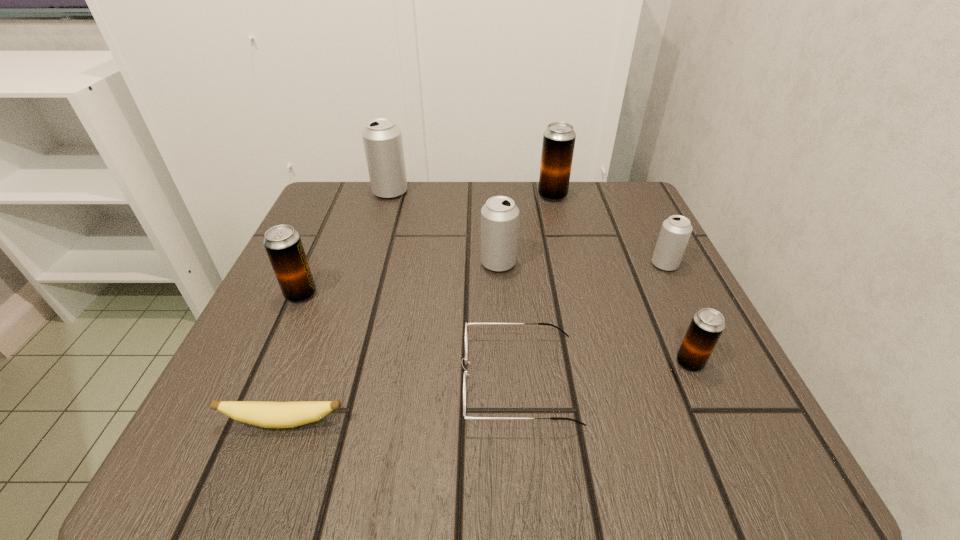
Find the location of a particular element. This screenshot has width=960, height=540. free location at the far edge is located at coordinates (507, 188).

The image size is (960, 540). Find the location of `vacant space at the near edge of the desktop`. vacant space at the near edge of the desktop is located at coordinates (559, 417).

The image size is (960, 540). What are the coordinates of `vacant space at the left edge of the desktop` in the screenshot? It's located at (276, 334).

I want to click on vacant space at the right edge of the desktop, so click(676, 337).

Locate an element on the screen. This screenshot has width=960, height=540. blank space at the far left corner is located at coordinates (375, 203).

In the image, there is a desktop. Find the location of `vacant region at the far right corner`. vacant region at the far right corner is located at coordinates (629, 215).

Locate an element on the screen. Image resolution: width=960 pixels, height=540 pixels. unoccupied area between the farthest white beer can and the rightmost white beer can is located at coordinates (527, 228).

This screenshot has height=540, width=960. Identify the location of free space between the fourth beer can from right to left and the fifth beer can from right to left. (444, 227).

Find the location of `vacant space in between the smallest black beer can and the yellow banana`. vacant space in between the smallest black beer can and the yellow banana is located at coordinates (487, 392).

Where is `free area in between the shortest object and the smallest white beer can`? Image resolution: width=960 pixels, height=540 pixels. free area in between the shortest object and the smallest white beer can is located at coordinates (474, 343).